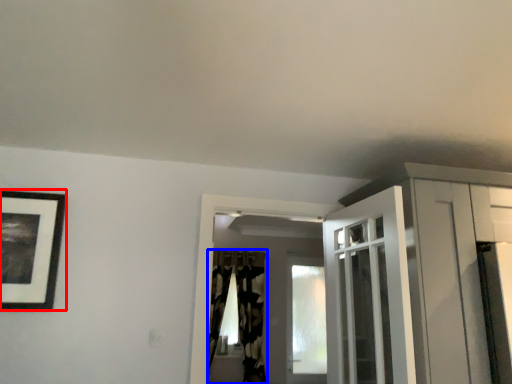
Question: Among these objects, which one is nearest to the camera, picture frame (highlighted by a red box) or curtain (highlighted by a blue box)?

Choices:
 (A) picture frame
 (B) curtain

Answer: (A)